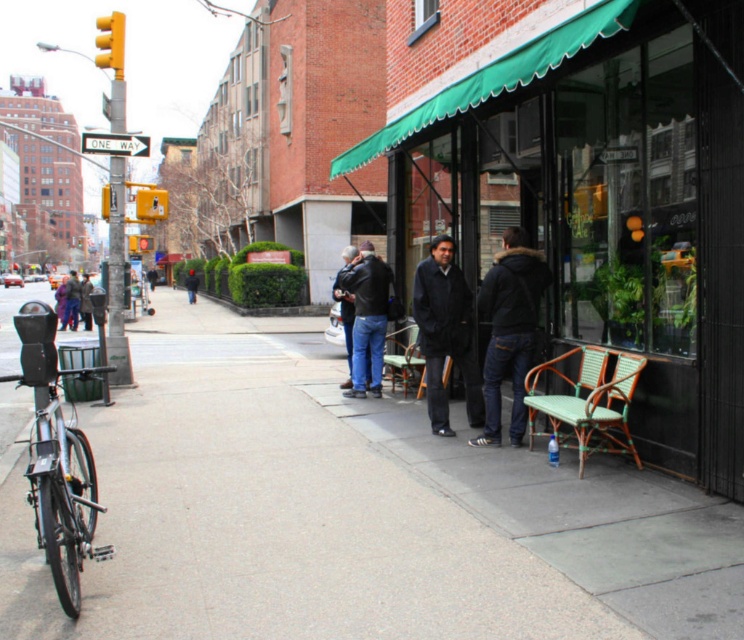
You are standing on the sidewalk in front of the store with the green awning. You see two points marked in the scene. The first point is at coordinates point (68, 513) and the second point is at point (516, 326). Which point is closer to you?

Point (68, 513) is closer to the camera than point (516, 326), so the first point is closer to you.

You are a delivery person with a 1.5 meter wide cart. You need to navigate through the smooth concrete sidewalk at center while avoiding the dark blue fabric jacket at center. Can your cart fit on the sidewalk without touching the jacket?

The smooth concrete sidewalk at center might be wider than dark blue fabric jacket at center, so there is a possibility that the cart can fit. However, since the exact width difference isn not specified, it is recommended to proceed cautiously.

You are a delivery person who needs to place a heavy box on the smooth concrete sidewalk at center. However, you notice the dark blue jeans at center nearby. Which object is lower to the ground, and why should you choose it for placing the box?

The smooth concrete sidewalk at center is lower to the ground compared to the dark blue jeans at center. You should choose the smooth concrete sidewalk at center to place the heavy box because it is closer to the ground, making it easier and safer to access.